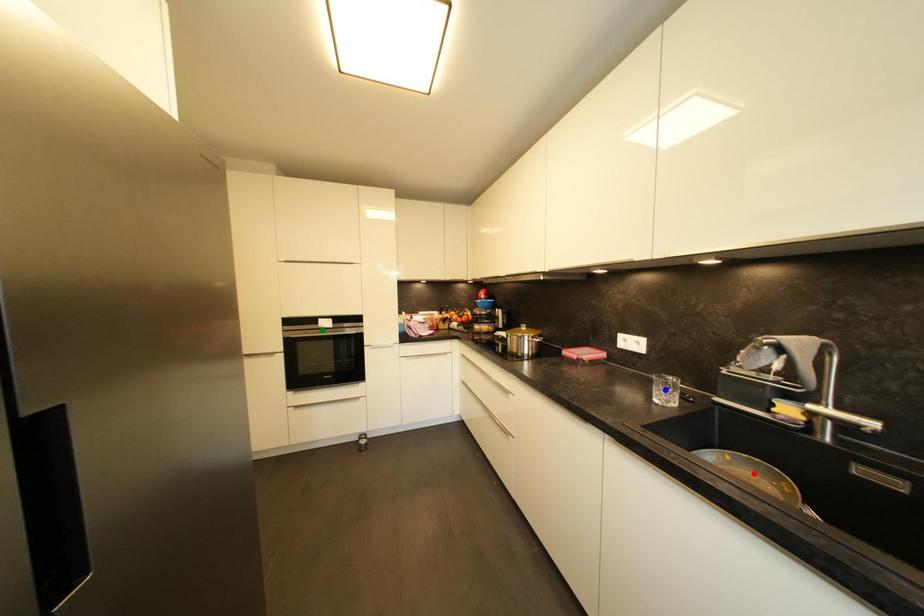
Order these from nearest to farthest:
A) red point
B) green point
C) blue point

1. green point
2. blue point
3. red point